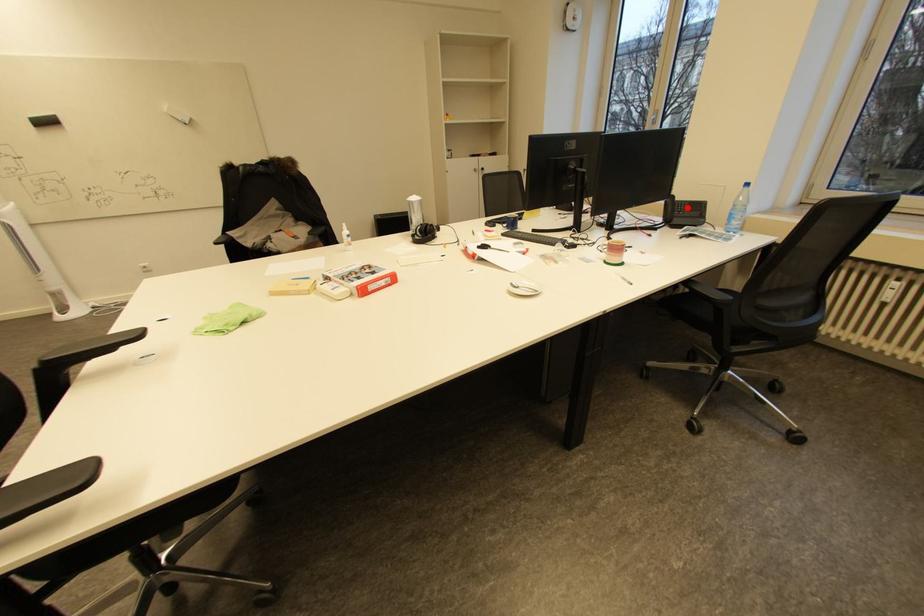
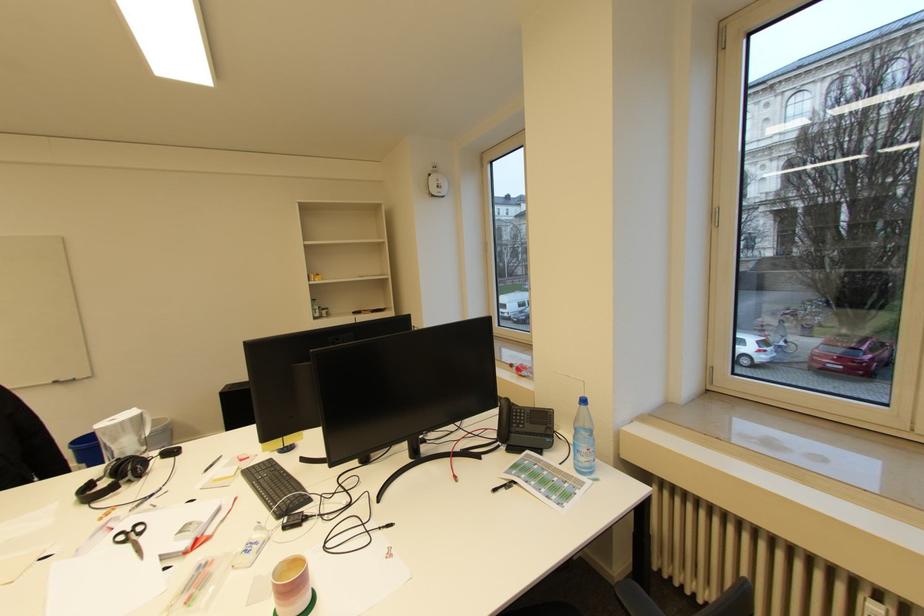
Find the pixel in the second image that matches the highlighted location in the first image.

(527, 416)